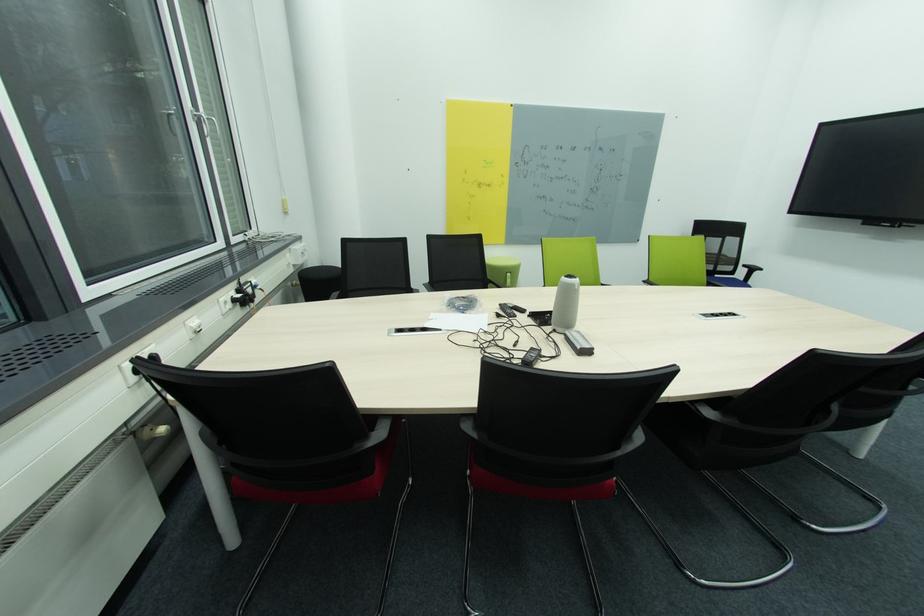
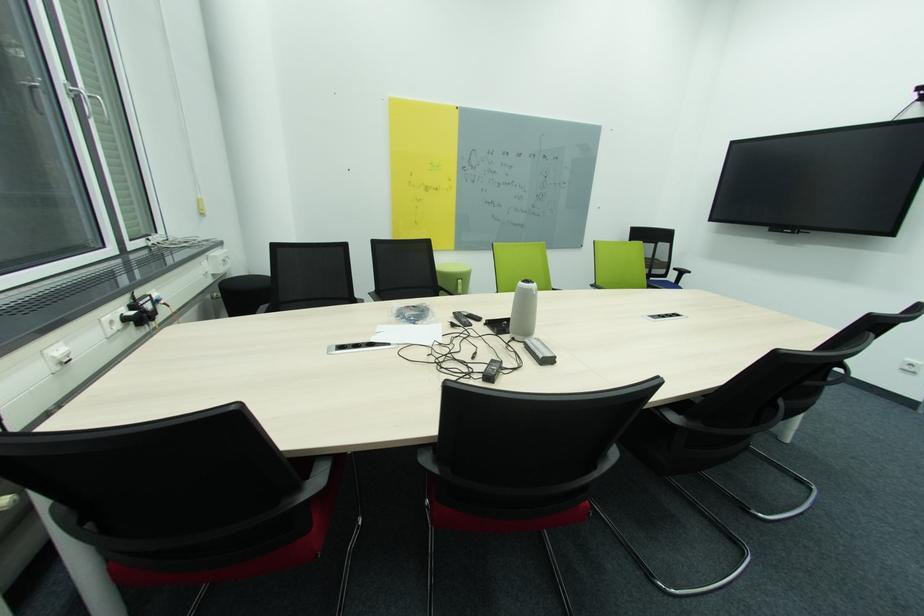
Where in the second image is the point corresponding to the point at 563,331 from the first image?

(521, 339)